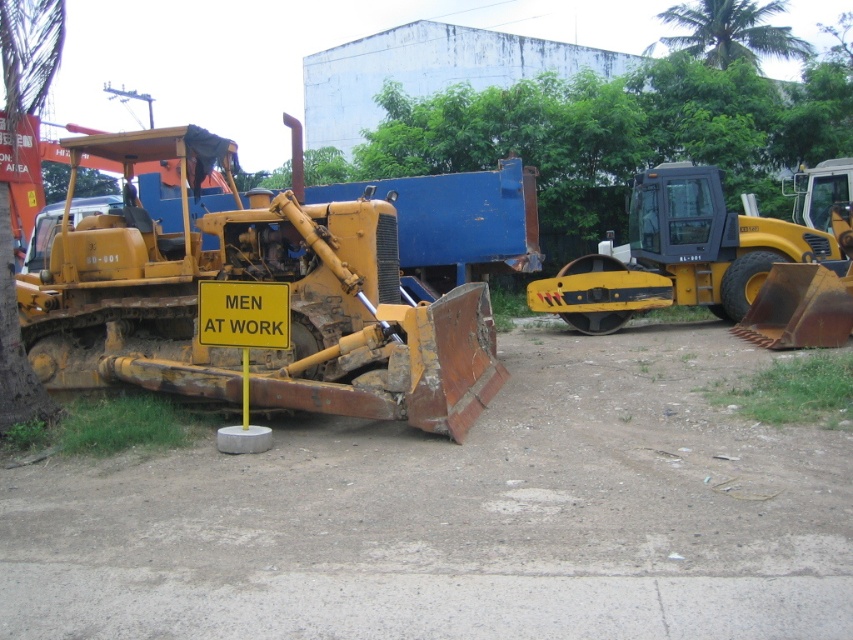
Question: Which point is farther from the camera taking this photo?

Choices:
 (A) (683, 44)
 (B) (253, 557)

Answer: (A)

Question: Is yellow metallic tractor at left positioned at the back of yellow rubber roller at right?

Choices:
 (A) yes
 (B) no

Answer: (B)

Question: Can you confirm if yellow metallic tractor at left is wider than yellow rubber roller at right?

Choices:
 (A) no
 (B) yes

Answer: (A)

Question: Estimate the real-world distances between objects in this image. Which object is farther from the yellow metallic tractor at left?

Choices:
 (A) yellow rubber roller at right
 (B) dirt track at center
 (C) green leafy tree at upper center

Answer: (C)

Question: Does yellow metallic tractor at left have a larger size compared to green leafy tree at upper center?

Choices:
 (A) no
 (B) yes

Answer: (A)

Question: Among these points, which one is farthest from the camera?

Choices:
 (A) (740, 246)
 (B) (389, 273)
 (C) (216, 483)
 (D) (784, 52)

Answer: (D)